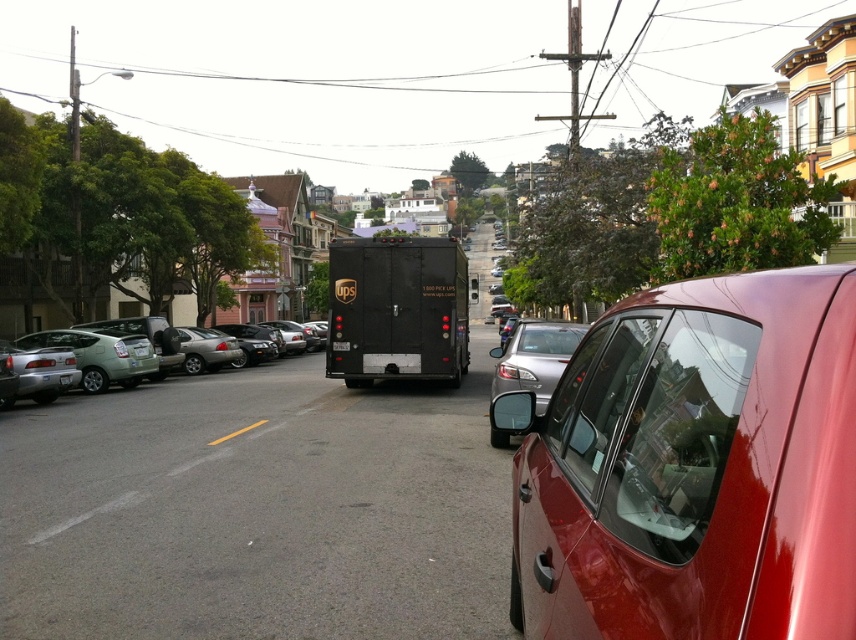
Which is more to the left, glossy red car at right or satin silver sedan at center?

glossy red car at right is more to the left.

Between glossy red car at right and satin silver sedan at center, which one is positioned higher?

glossy red car at right

Who is more distant from viewer, [818,289] or [553,380]?

The point [553,380] is behind.

At what (x,y) coordinates should I click in order to perform the action: click on glossy red car at right. Please return your answer as a coordinate pair (x, y). Looking at the image, I should click on (693, 467).

Does matte black car at left appear on the right side of black matte license plate at center?

In fact, matte black car at left is to the left of black matte license plate at center.

In the scene shown: Does matte black car at left lie behind black matte license plate at center?

Yes.

Describe the element at coordinates (143, 346) in the screenshot. I see `matte black car at left` at that location.

Find the location of a particular element. This screenshot has height=640, width=856. matte black car at left is located at coordinates (143, 346).

Is satin silver sedan at center wider than black matte license plate at center?

Correct, the width of satin silver sedan at center exceeds that of black matte license plate at center.

Is point (528, 332) closer to camera compared to point (66, 378)?

That is True.

I want to click on satin silver sedan at center, so click(535, 356).

I want to click on satin silver sedan at center, so click(x=535, y=356).